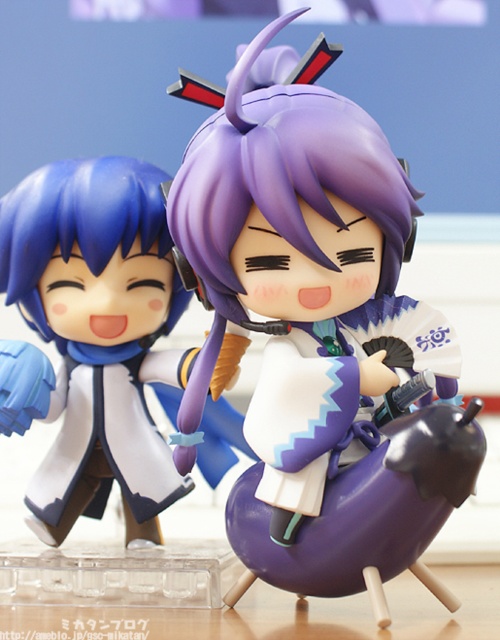
You are arranging these two figures on a shelf. The purple matte figure at center needs to be placed to the right of the matte blue doll at left. Does the current arrangement already meet this requirement?

Yes, the purple matte figure at center is already positioned to the right of the matte blue doll at left as required.

You are organizing a display shelf and want to arrange the purple matte figure at center and the matte blue doll at left based on their heights. Which one should you place on the higher shelf to match their actual heights?

The purple matte figure at center is taller than the matte blue doll at left, so you should place the purple matte figure at center on the higher shelf to match their actual heights.